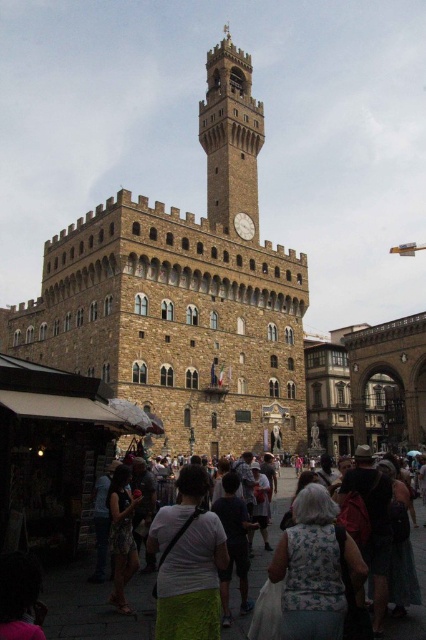
Does brown stone tower at center come in front of dark gray fabric crowd at lower center?

No, brown stone tower at center is behind dark gray fabric crowd at lower center.

Is point (218, 401) positioned after point (287, 483)?

No, (218, 401) is in front of (287, 483).

This screenshot has height=640, width=426. I want to click on brown stone tower at center, so click(183, 296).

Can you confirm if brown stone tower at center is smaller than white matte clock at center?

No.

Identify the location of brown stone tower at center. (183, 296).

In the scene shown: Is stone clock tower at center above white fabric at center?

Yes.

Is stone clock tower at center shorter than white fabric at center?

In fact, stone clock tower at center may be taller than white fabric at center.

Which is in front, point (221, 51) or point (184, 481)?

Point (184, 481) is in front.

Locate an element on the screen. The width and height of the screenshot is (426, 640). stone clock tower at center is located at coordinates (230, 134).